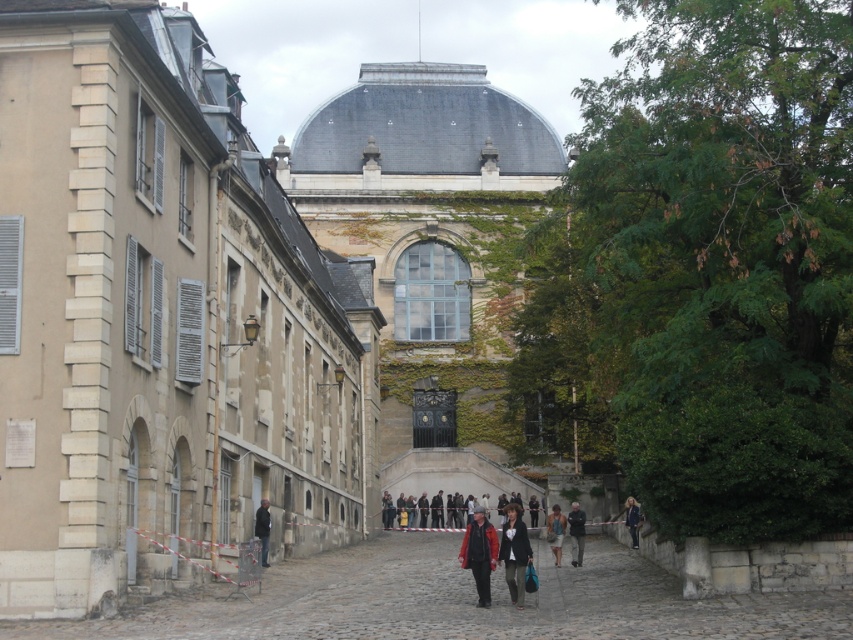
You are a photographer planning to take a wide shot of the beige stone building at left and the denim jacket at lower center. Since you want both objects to be clearly visible in the frame, which object should you focus on to ensure proper focus, considering their sizes?

The beige stone building at left is larger in size than the denim jacket at lower center. To ensure both are clearly visible, focus on the beige stone building at left since it is the larger object and will require more detailed focus.